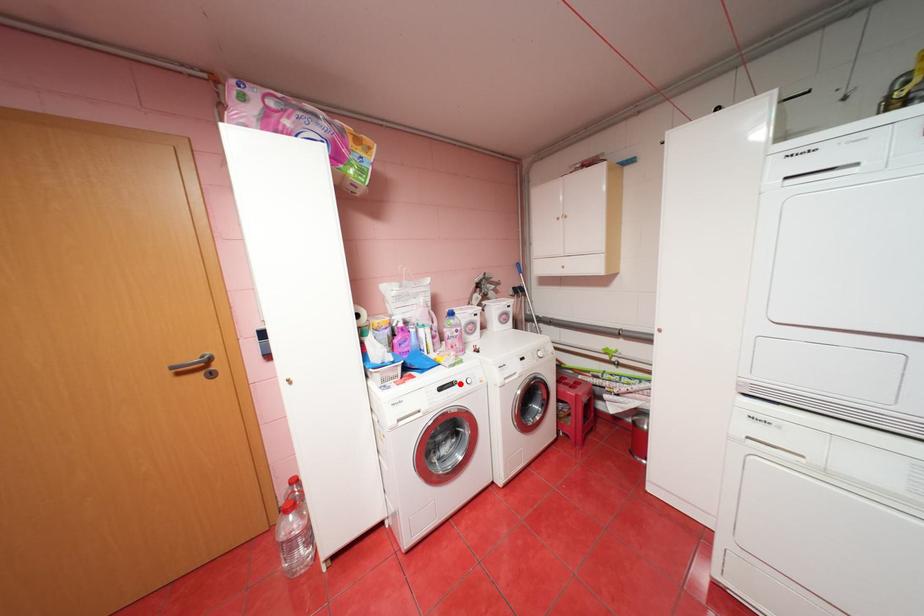
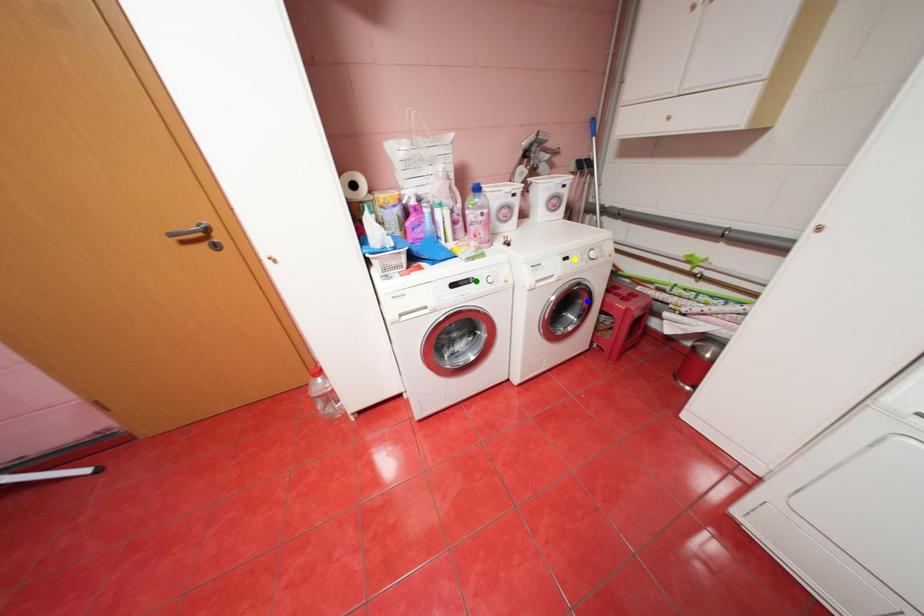
Question: I am providing you with two images of the same scene from different viewpoints. A red point is marked on the first image. You are given multiple points on the second image. In image 2, which mark is for the same physical point as the one in image 1?

Choices:
 (A) blue point
 (B) green point
 (C) yellow point

Answer: (B)